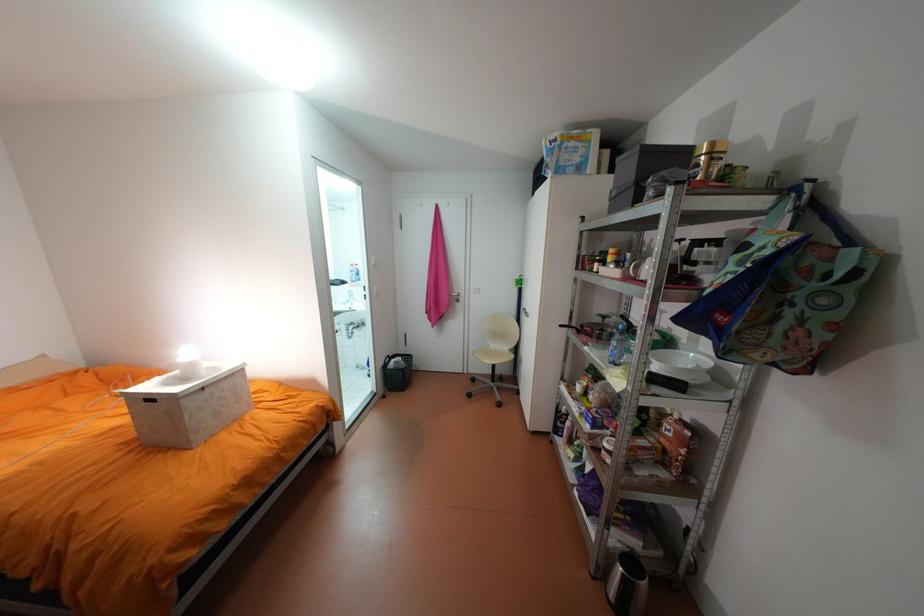
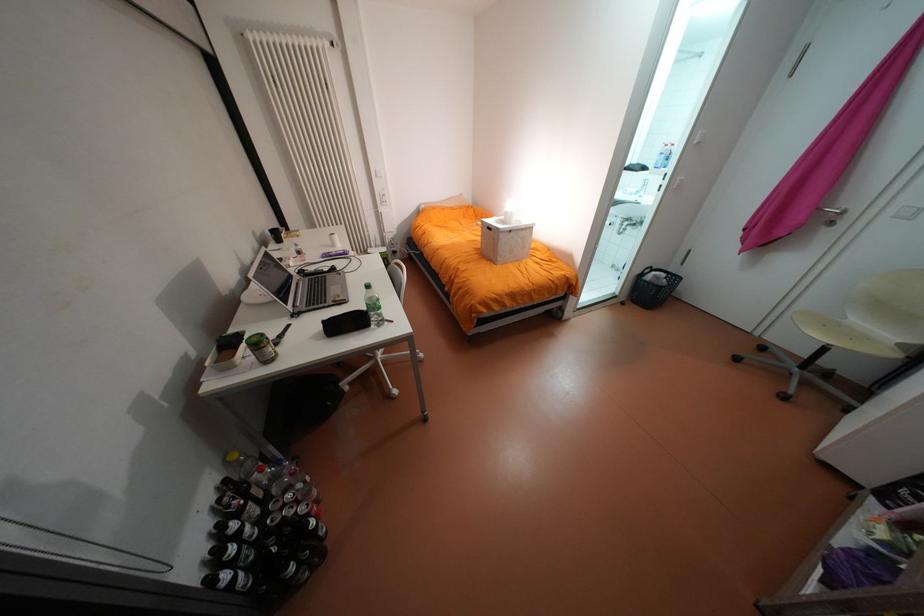
Locate, in the second image, the point that corresponds to [402,360] in the first image.

(663, 273)